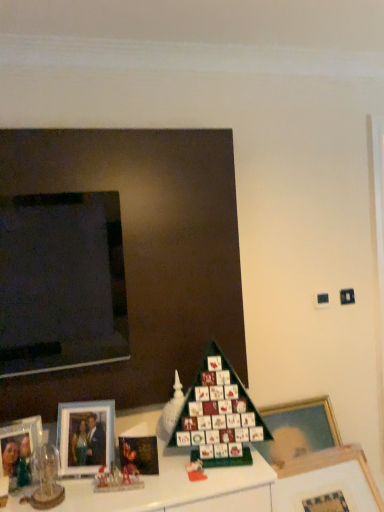
Locate an element on the screen. spots to the right of matte plastic toy at lower center is located at coordinates (229, 470).